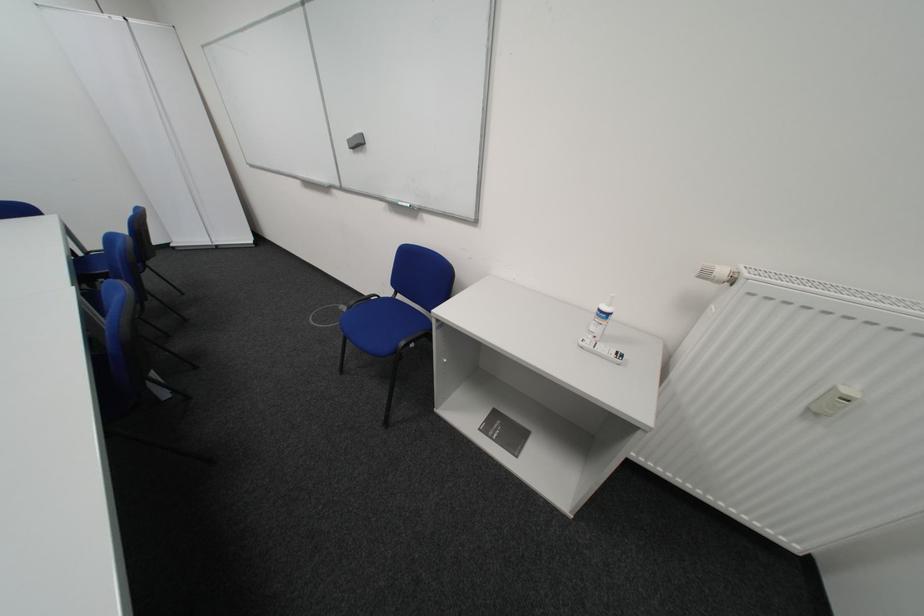
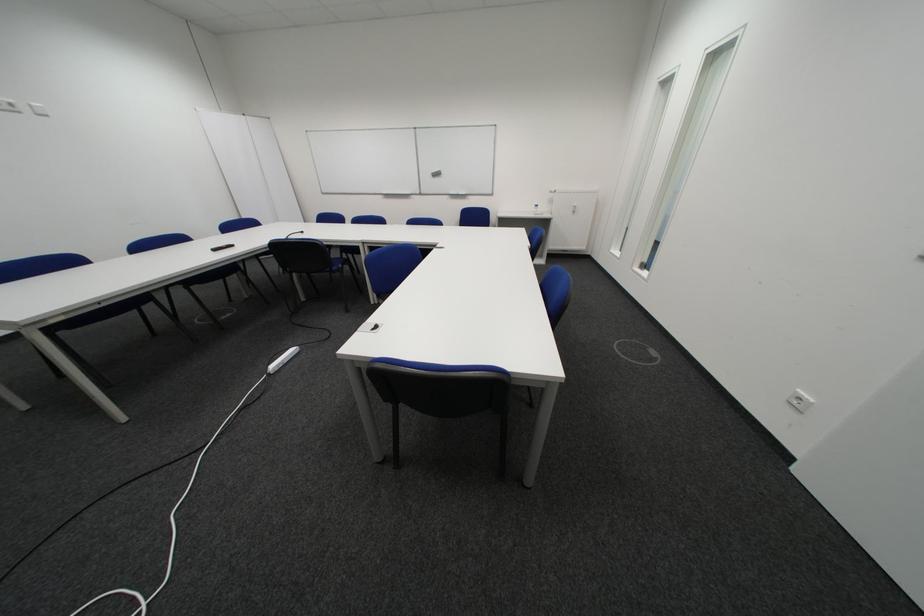
Where in the second image is the point corresponding to pixel 599 345 from the first image?

(548, 215)